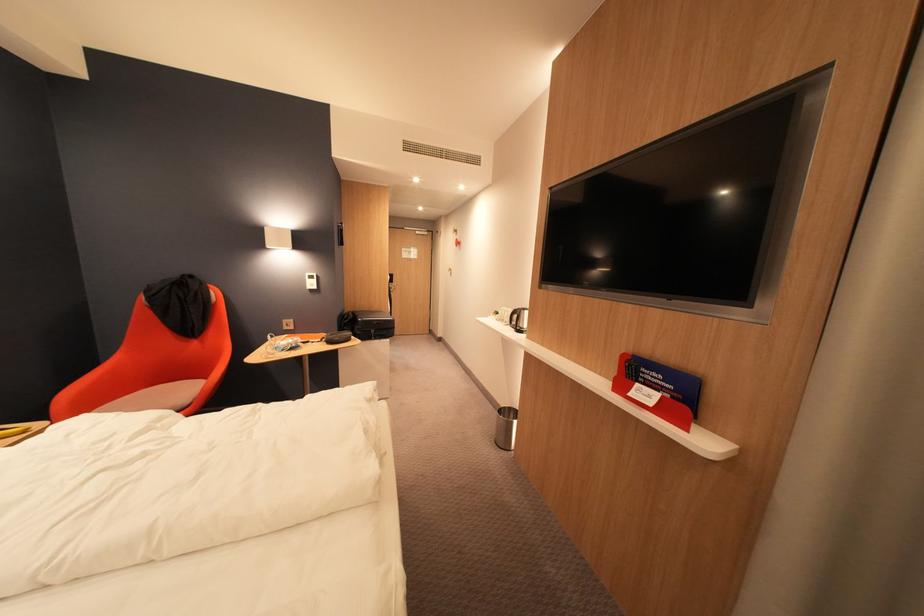
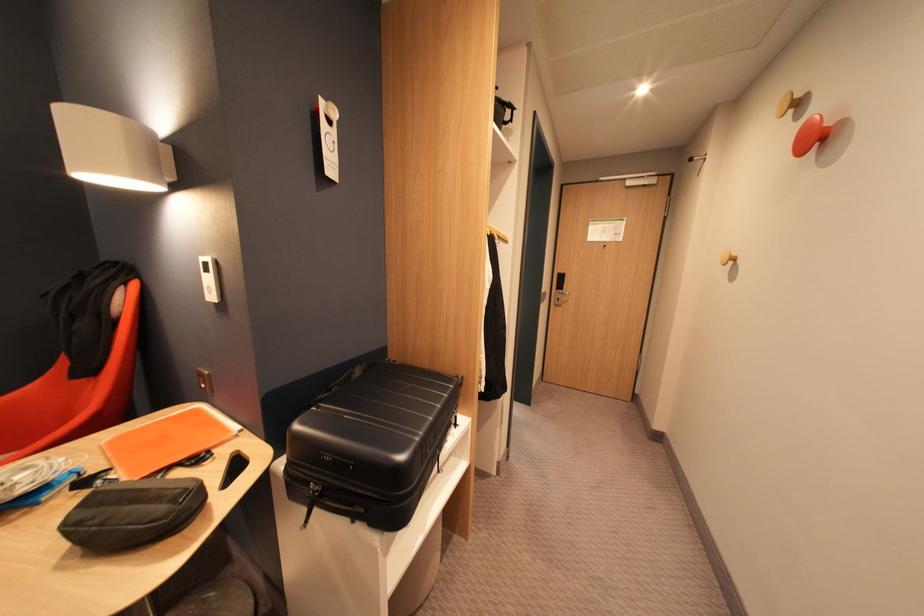
The point at (323, 277) is marked in the first image. Where is the corresponding point in the second image?

(216, 265)